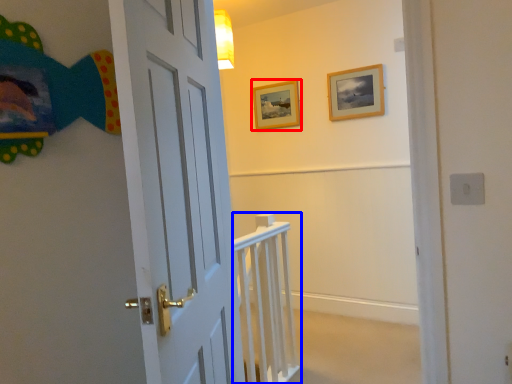
Question: Which object appears farthest to the camera in this image, picture frame (highlighted by a red box) or rail (highlighted by a blue box)?

Choices:
 (A) picture frame
 (B) rail

Answer: (A)